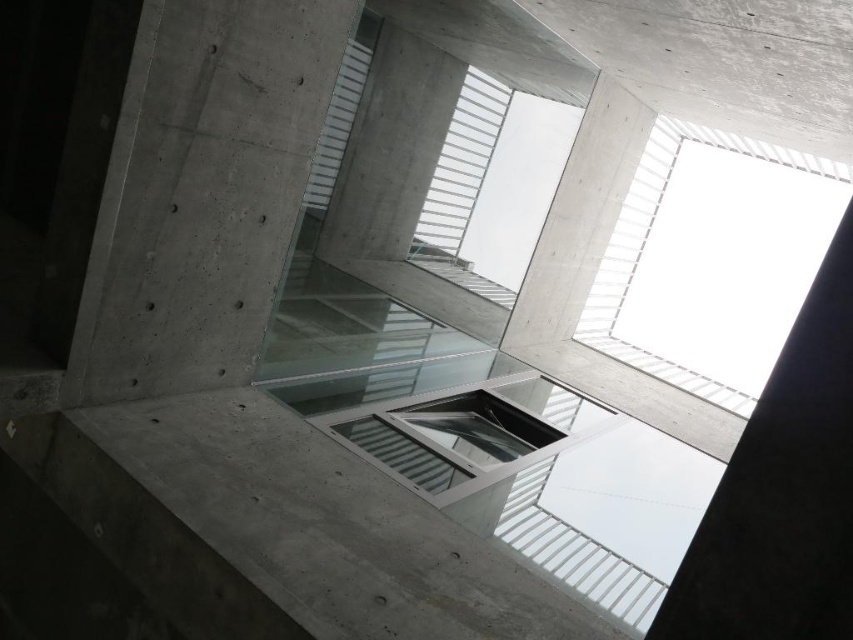
You are standing at the base of the modern architectural structure and notice the concrete at left and the transparent glass window at upper center. Which object is positioned further to the left side of the structure?

The concrete at left is positioned further to the left side of the structure compared to the transparent glass window at upper center.

You are standing at the base of the modern architectural structure. Looking up, you see the concrete at left and the transparent glass window at upper center. Which object is positioned higher in the structure?

The concrete at left is located above the transparent glass window at upper center, so it is positioned higher in the structure.

You are standing at the base of the building looking up. Can you see the transparent glass window at upper center through the concrete at left?

The concrete at left is in front of the transparent glass window at upper center, so it blocks the view of the transparent glass window at upper center from your perspective.